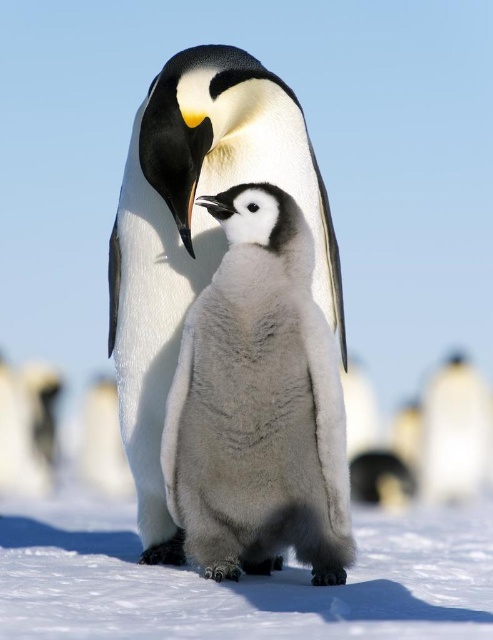
Question: Can you confirm if white fluffy penguin at center is positioned to the right of white fluffy penguin at lower right?

Choices:
 (A) no
 (B) yes

Answer: (A)

Question: Can you confirm if white fluffy snow at lower center is smaller than white fluffy penguin at lower right?

Choices:
 (A) yes
 (B) no

Answer: (A)

Question: Which of the following is the closest to the observer?

Choices:
 (A) white fluffy penguin at lower right
 (B) white fluffy penguin at center

Answer: (B)

Question: Does white fluffy snow at lower center appear over white fluffy penguin at lower right?

Choices:
 (A) yes
 (B) no

Answer: (A)

Question: Which point is closer to the camera?

Choices:
 (A) pyautogui.click(x=322, y=593)
 (B) pyautogui.click(x=240, y=161)

Answer: (A)

Question: Which object is farther from the camera taking this photo?

Choices:
 (A) white fluffy penguin at lower right
 (B) white fluffy penguin at center
 (C) white fluffy snow at lower center

Answer: (A)